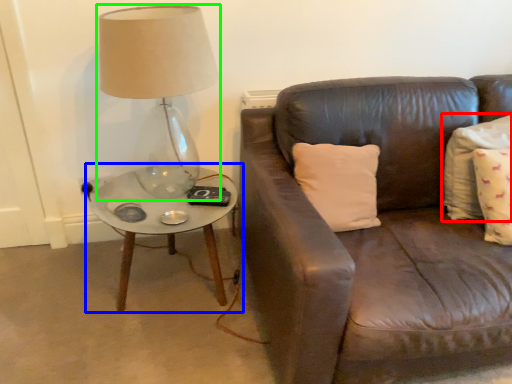
Question: Estimate the real-world distances between objects in this image. Which object is farther from pillow (highlighted by a red box), coffee table (highlighted by a blue box) or lamp (highlighted by a green box)?

Choices:
 (A) coffee table
 (B) lamp

Answer: (B)